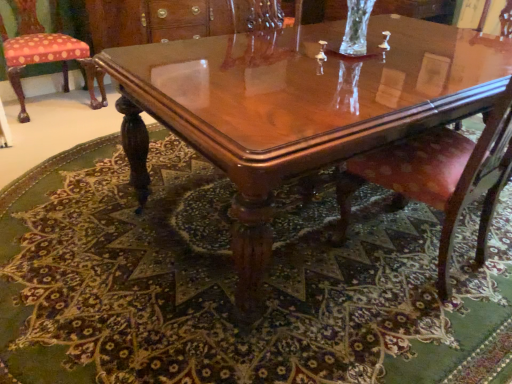
Locate an element on the screen. Image resolution: width=512 pixels, height=384 pixels. vacant location below polka dot fabric cushion at left, marked as the 1th chair in a top-to-bottom arrangement (from a real-world perspective) is located at coordinates (54, 105).